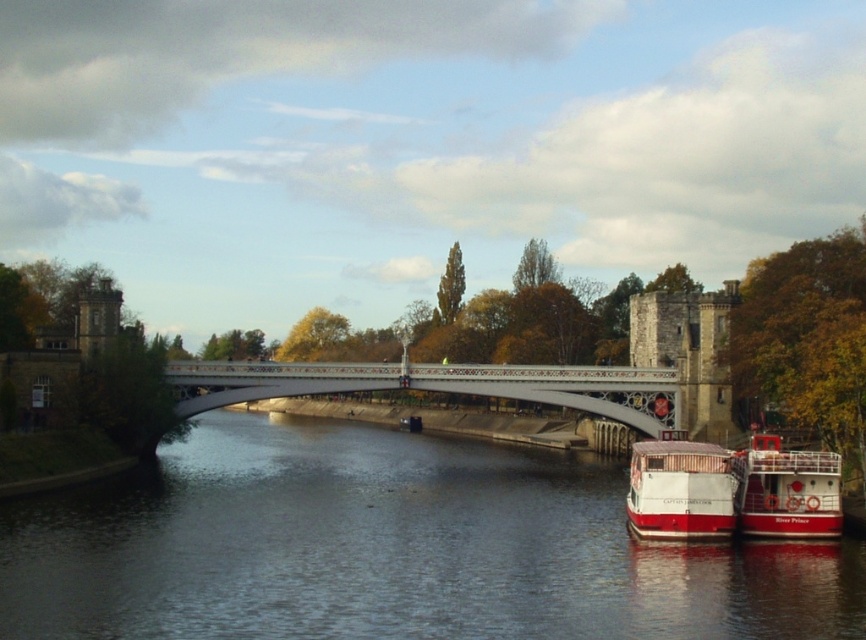
Is white metallic bridge at center to the left of red matte boat at lower right from the viewer's perspective?

Correct, you'll find white metallic bridge at center to the left of red matte boat at lower right.

Based on the photo, does white metallic bridge at center have a larger size compared to red matte boat at lower right?

Correct, white metallic bridge at center is larger in size than red matte boat at lower right.

This screenshot has width=866, height=640. Identify the location of white metallic bridge at center. (438, 385).

Who is lower down, dark blue water at center or white matte boat at lower right?

dark blue water at center is below.

Between dark blue water at center and white matte boat at lower right, which one appears on the right side from the viewer's perspective?

Positioned to the right is white matte boat at lower right.

Does point (806, 554) come farther from viewer compared to point (648, 477)?

No, (806, 554) is in front of (648, 477).

What are the coordinates of `dark blue water at center` in the screenshot? It's located at (391, 548).

Is the position of dark blue water at center more distant than that of white metallic bridge at center?

No, dark blue water at center is in front of white metallic bridge at center.

Which is in front, point (488, 595) or point (661, 428)?

Point (488, 595) is in front.

What are the coordinates of `dark blue water at center` in the screenshot? It's located at (391, 548).